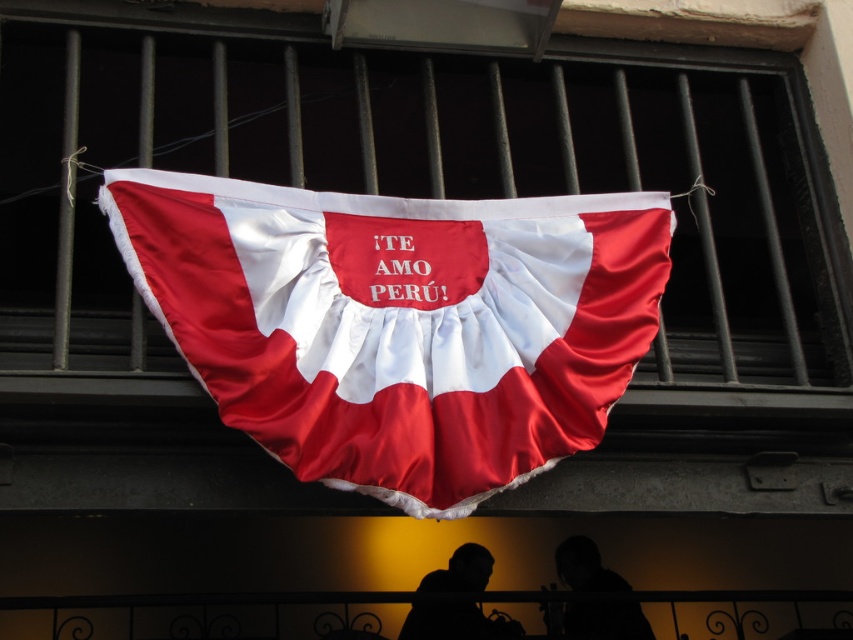
Question: Considering the real-world distances, which object is closest to the silhouette figure at center?

Choices:
 (A) black wrought iron railing at lower center
 (B) silhouette fabric at center
 (C) silky satin flag at center
 (D) matte fabric banner at center

Answer: (B)

Question: From the image, what is the correct spatial relationship of matte fabric banner at center in relation to silky satin flag at center?

Choices:
 (A) below
 (B) above

Answer: (B)

Question: Does silky satin flag at center lie in front of silhouette fabric at center?

Choices:
 (A) no
 (B) yes

Answer: (B)

Question: Which of the following is the farthest from the observer?

Choices:
 (A) black wrought iron railing at lower center
 (B) matte fabric banner at center
 (C) silky satin flag at center

Answer: (A)

Question: Is silhouette fabric at center bigger than silhouette figure at center?

Choices:
 (A) no
 (B) yes

Answer: (B)

Question: Which point appears farthest from the camera in this image?

Choices:
 (A) (42, 106)
 (B) (488, 621)

Answer: (B)